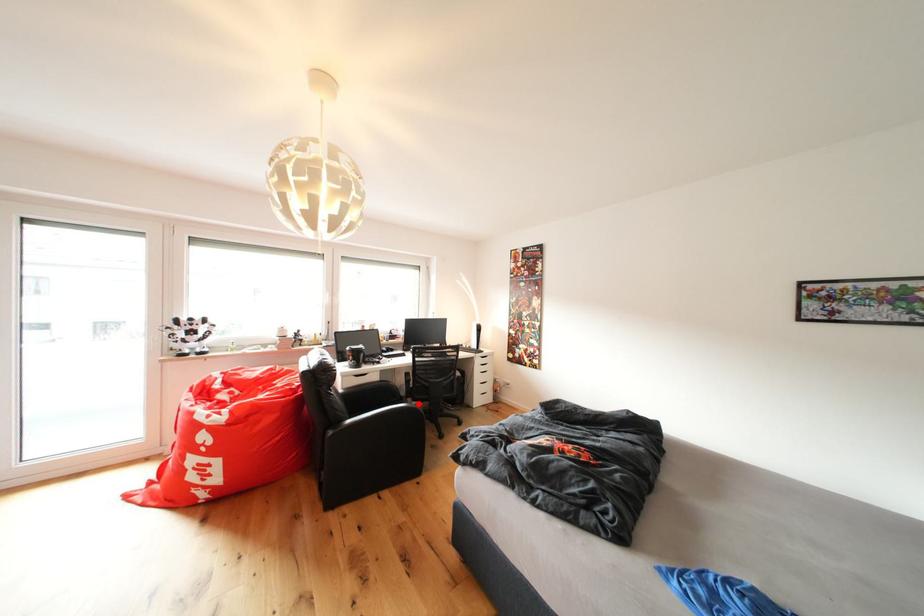
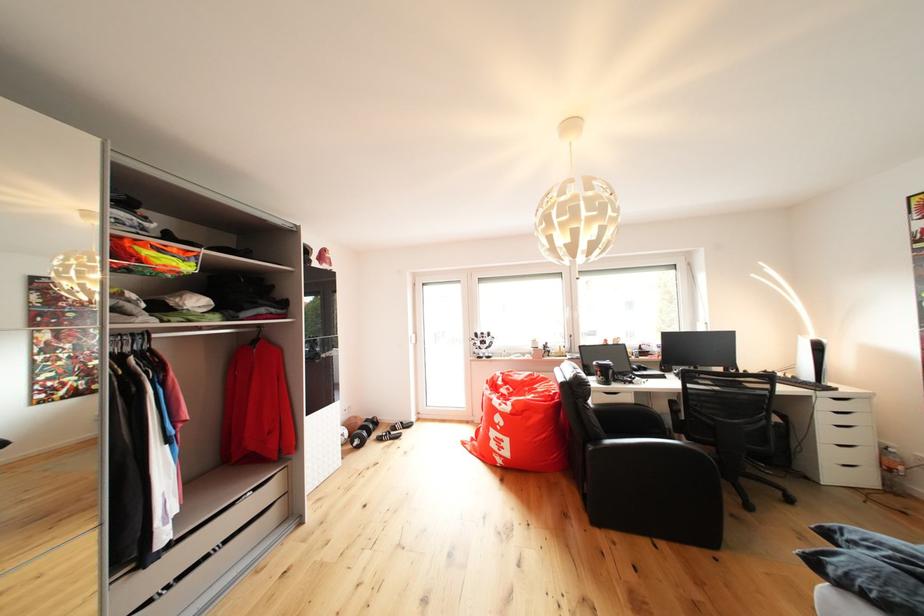
Locate, in the second image, the point that corresponds to the highlighted location in the first image.

(686, 439)